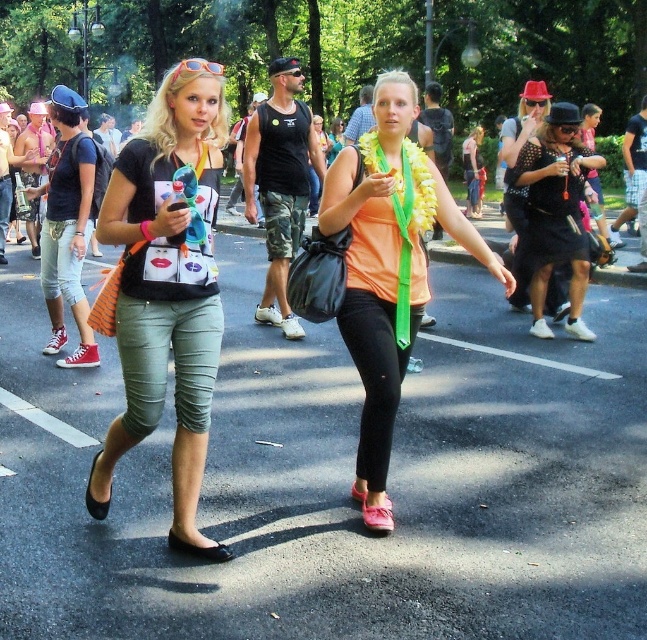
Question: Which is farther from the orange fabric top at center?

Choices:
 (A) matte black shirt at left
 (B) black leather flat shoe at lower center
 (C) black leather sandal at lower left

Answer: (C)

Question: Which object appears farthest from the camera in this image?

Choices:
 (A) black leather sandal at lower left
 (B) black leather flat shoe at lower center
 (C) black studded dress at center

Answer: (C)

Question: Can you confirm if matte black shirt at left is positioned above black leather sandal at lower left?

Choices:
 (A) yes
 (B) no

Answer: (A)

Question: Can you confirm if black studded dress at center is positioned to the left of black leather sandal at lower left?

Choices:
 (A) yes
 (B) no

Answer: (B)

Question: Which object is the farthest from the orange fabric top at center?

Choices:
 (A) matte black shirt at left
 (B) black studded dress at center
 (C) black leather sandal at lower left
 (D) black leather flat shoe at lower center

Answer: (B)

Question: Is matte black shirt at left below black leather sandal at lower left?

Choices:
 (A) yes
 (B) no

Answer: (B)